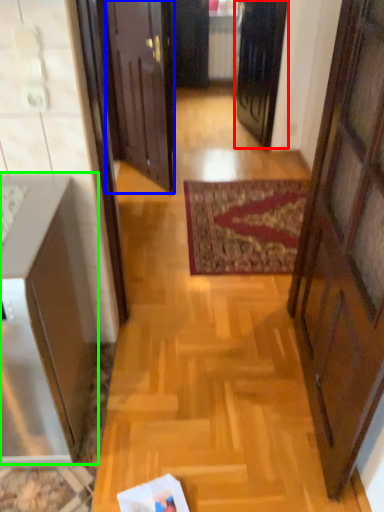
Question: Considering the real-world distances, which object is farthest from door (highlighted by a red box)? door (highlighted by a blue box) or cabinetry (highlighted by a green box)?

Choices:
 (A) door
 (B) cabinetry

Answer: (B)